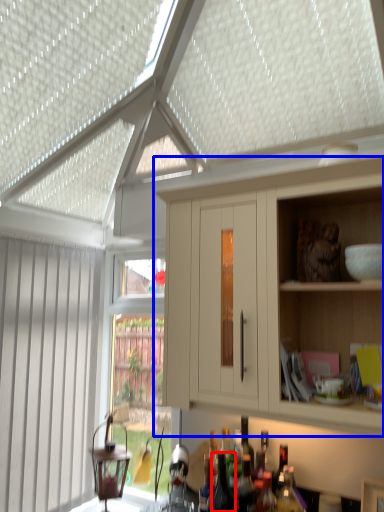
Question: Which object is further to the camera taking this photo, bottle (highlighted by a red box) or cabinetry (highlighted by a blue box)?

Choices:
 (A) bottle
 (B) cabinetry

Answer: (A)